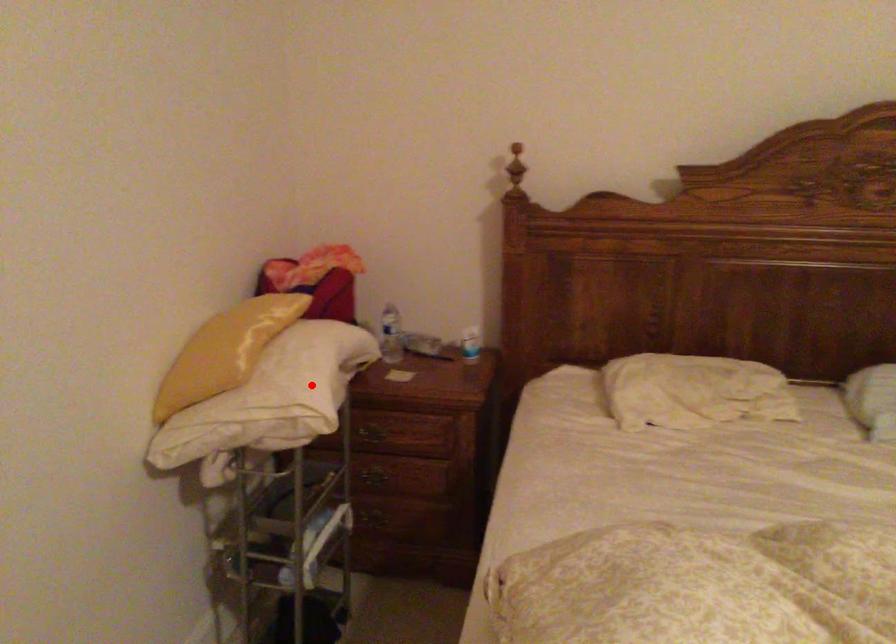
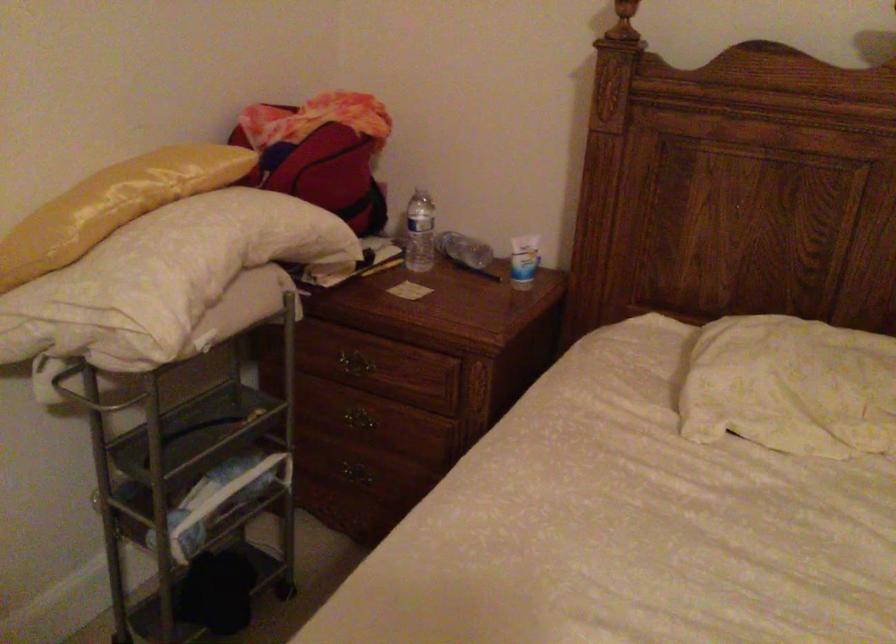
Where in the second image is the point corresponding to the highlighted location from the first image?

(164, 278)